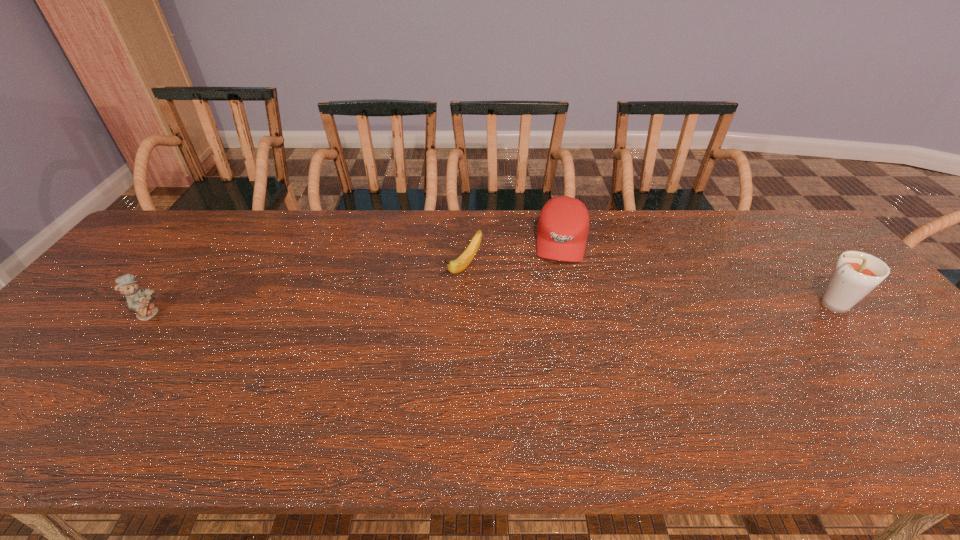
Where is `vacant area located 0.250m on the front-facing side of the cap`? This screenshot has height=540, width=960. vacant area located 0.250m on the front-facing side of the cap is located at coordinates (556, 330).

I want to click on free space located 0.060m on the front-facing side of the cap, so click(561, 280).

I want to click on vacant space situated on the front-facing side of the cap, so click(553, 357).

Find the location of a particular element. free region located at the stem of the shortest object is located at coordinates (372, 376).

Locate an element on the screen. vacant space located 0.310m at the stem of the shortest object is located at coordinates 386,361.

Identify the location of vacant region located at the stem of the shortest object. (445, 294).

Image resolution: width=960 pixels, height=540 pixels. Find the location of `cap that is positioned at the far edge`. cap that is positioned at the far edge is located at coordinates (563, 225).

You are a GUI agent. You are given a task and a screenshot of the screen. Output one action in this format:
    pyautogui.click(x=<x>, y=<y>)
    Task: Click on the banana positioned at the far edge
    The width and height of the screenshot is (960, 540).
    Given the screenshot: What is the action you would take?
    pyautogui.click(x=462, y=262)

This screenshot has height=540, width=960. I want to click on object that is at the right edge, so click(x=856, y=274).

Where is `vacant space at the far edge`? This screenshot has height=540, width=960. vacant space at the far edge is located at coordinates (288, 230).